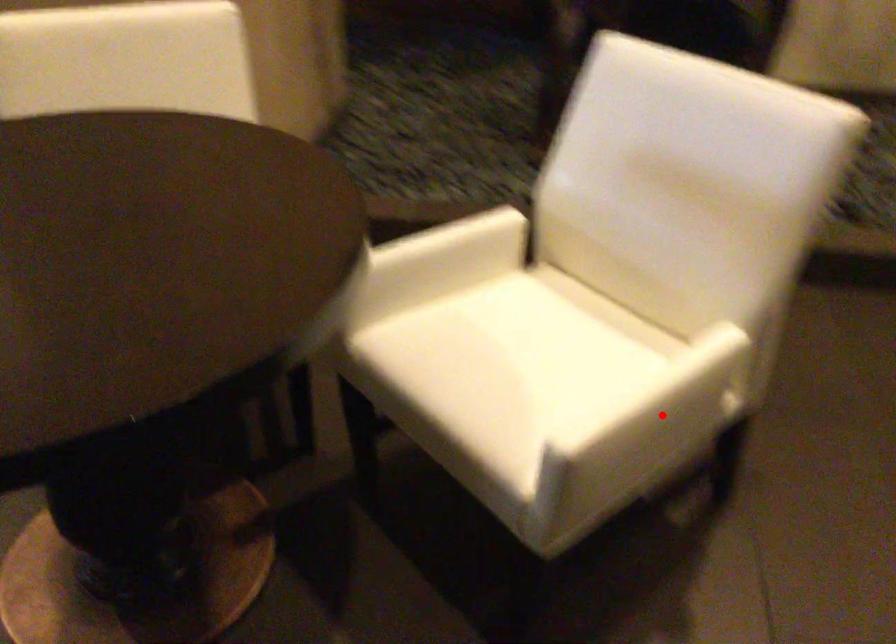
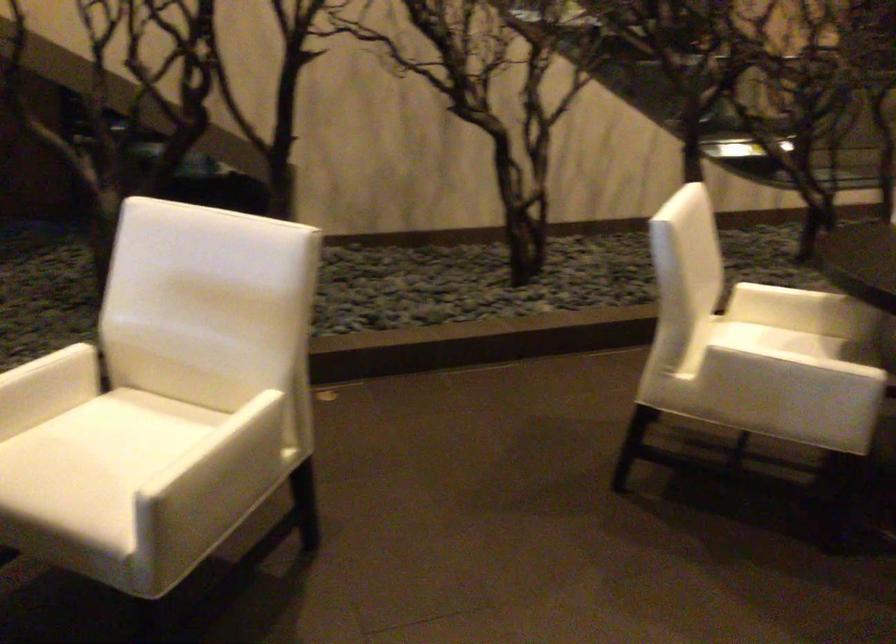
The point at the highlighted location is marked in the first image. Where is the corresponding point in the second image?

(225, 462)